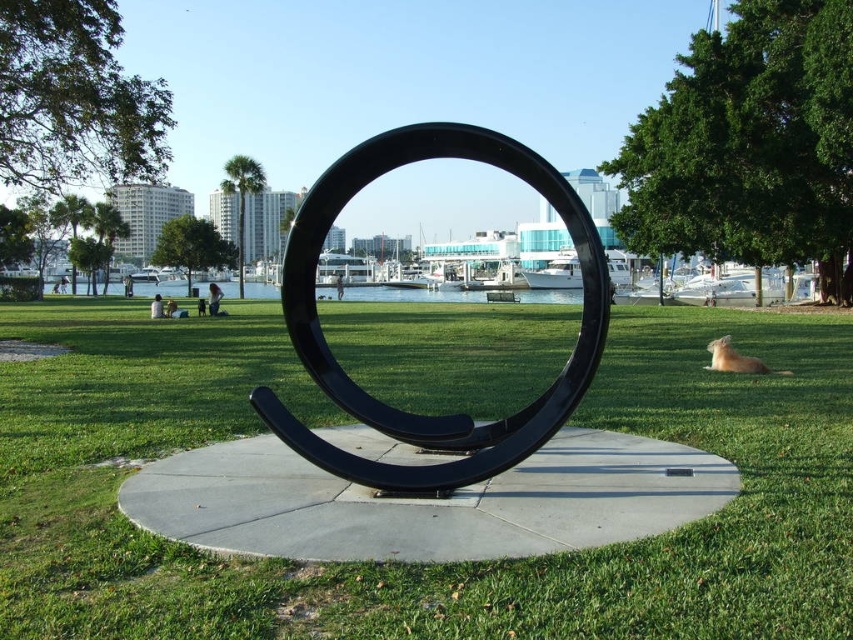
Is green grass at center below black matte horseshoe at center?

No.

Who is positioned more to the left, green grass at center or black matte horseshoe at center?

Positioned to the left is black matte horseshoe at center.

Is point (846, 448) positioned before point (502, 160)?

No, it is behind (502, 160).

Locate an element on the screen. This screenshot has width=853, height=640. green grass at center is located at coordinates (419, 566).

Does green grass at center appear on the right side of dark blue jeans at center?

Correct, you'll find green grass at center to the right of dark blue jeans at center.

Which is behind, point (749, 456) or point (218, 288)?

Point (218, 288)

Locate an element on the screen. This screenshot has height=640, width=853. green grass at center is located at coordinates (419, 566).

This screenshot has height=640, width=853. Describe the element at coordinates (213, 298) in the screenshot. I see `dark blue jeans at center` at that location.

Does point (212, 291) come closer to viewer compared to point (341, 285)?

Yes, point (212, 291) is closer to viewer.

Locate an element on the screen. This screenshot has height=640, width=853. dark blue jeans at center is located at coordinates (213, 298).